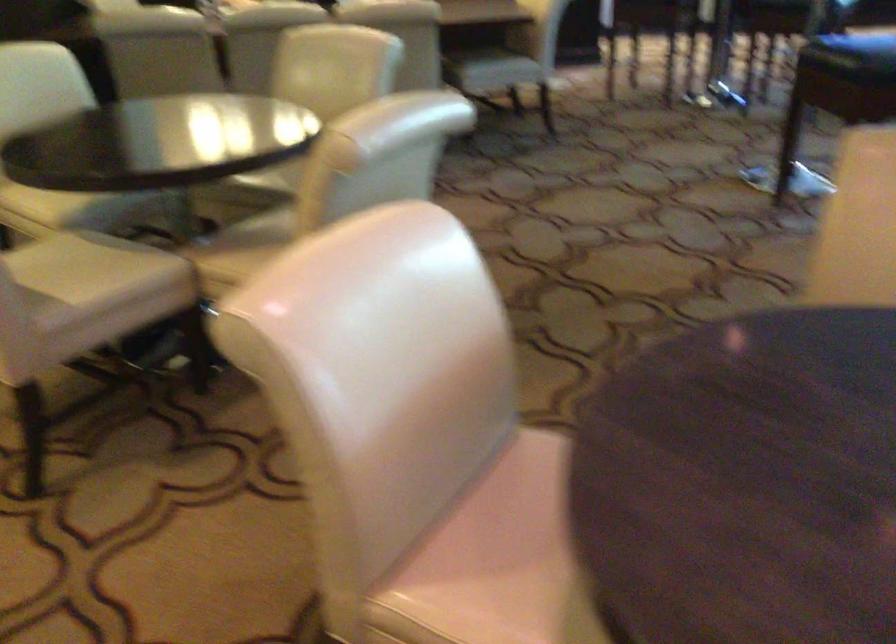
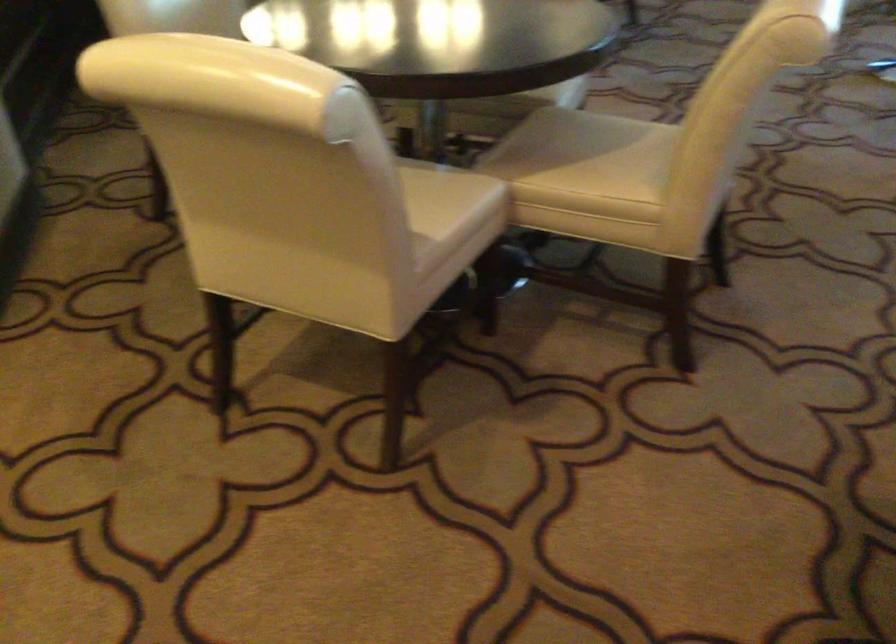
Where in the second image is the point corresponding to point (136, 249) from the first image?

(437, 167)